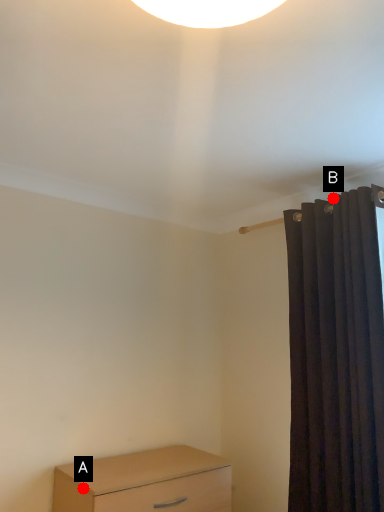
Question: Two points are circled on the image, labeled by A and B beside each circle. Which point appears closest to the camera in this image?

Choices:
 (A) A is closer
 (B) B is closer

Answer: (A)